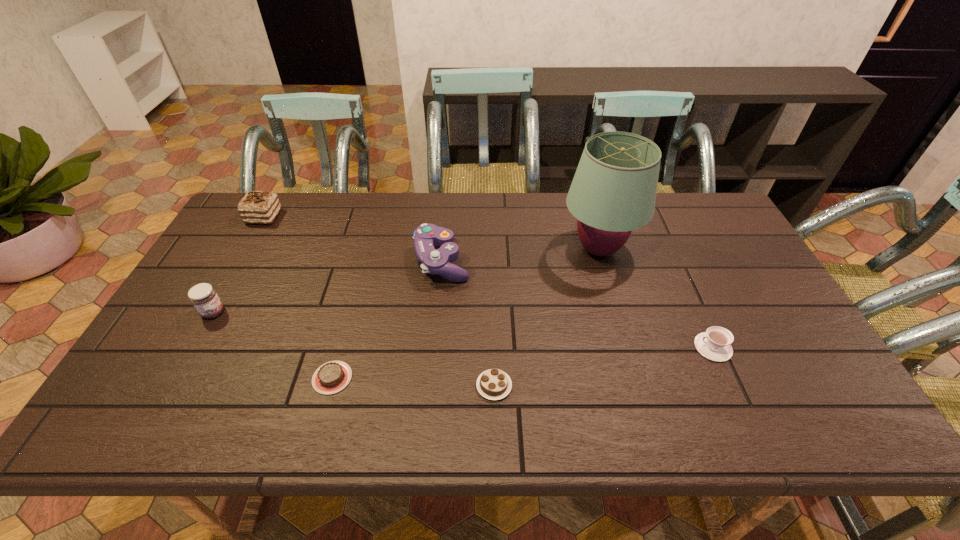
Locate which object is the sixth closest to the fifth object from left to right. Please provide its 2D coordinates. Your answer should be formatted as a tuple, i.e. [(x, y)], where the tuple contains the x and y coordinates of a point satisfying the conditions above.

[(257, 207)]

The width and height of the screenshot is (960, 540). I want to click on the second closest chocolate cake to the control, so pos(494,384).

Image resolution: width=960 pixels, height=540 pixels. I want to click on chocolate cake that is the third closest one to the jam, so click(x=494, y=384).

This screenshot has height=540, width=960. Find the location of `free location that satisfies the following two spatial constraints: 1. on the front side of the rightmost chocolate cake; 2. on the right side of the third object from left to right`. free location that satisfies the following two spatial constraints: 1. on the front side of the rightmost chocolate cake; 2. on the right side of the third object from left to right is located at coordinates (330, 386).

Find the location of a particular element. The height and width of the screenshot is (540, 960). free space that satisfies the following two spatial constraints: 1. on the front label of the third object from right to left; 2. on the right side of the fourth nearest object is located at coordinates (173, 386).

The width and height of the screenshot is (960, 540). I want to click on blank area in the image that satisfies the following two spatial constraints: 1. on the back side of the third object from left to right; 2. on the front label of the jam, so click(350, 313).